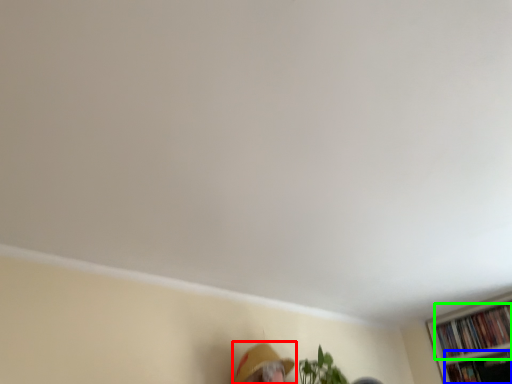
Question: Considering the real-world distances, which object is farthest from person (highlighted by a red box)? book (highlighted by a blue box) or book (highlighted by a green box)?

Choices:
 (A) book
 (B) book

Answer: (A)